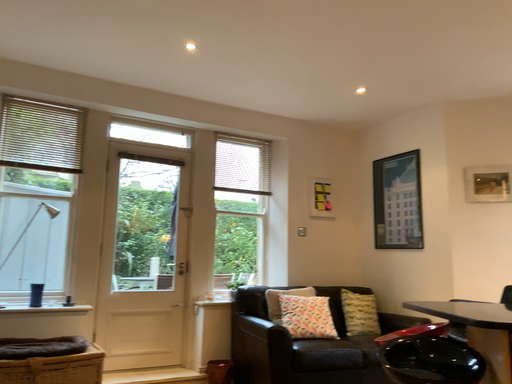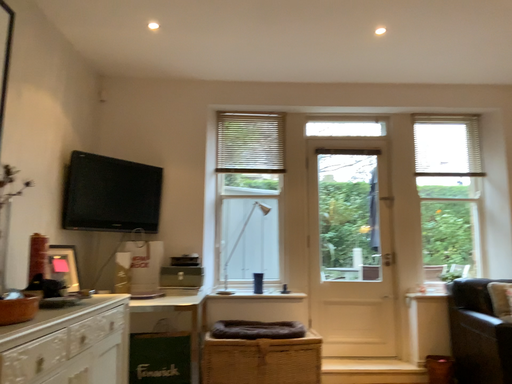
Question: Which way did the camera rotate in the video?

Choices:
 (A) rotated right
 (B) rotated left

Answer: (B)